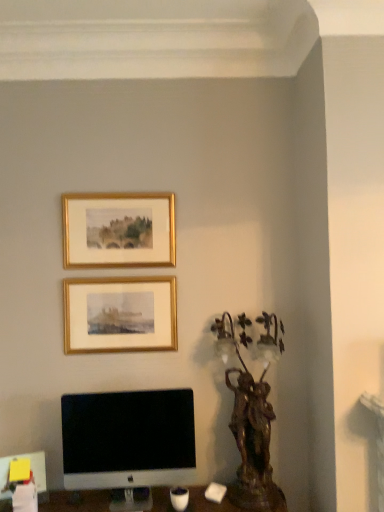
Question: In which direction should I rotate to look at gold/gilded picture frame at upper center, the 2th picture frame from the bottom?

Choices:
 (A) left
 (B) right

Answer: (A)

Question: Which direction should I rotate to look at gold/gilded picture frame at upper center, the 1th picture frame from the bottom?

Choices:
 (A) right
 (B) left

Answer: (B)

Question: Does white glossy computer monitor at lower left have a smaller size compared to gold/gilded picture frame at upper center, positioned as the 2th picture frame in top-to-bottom order?

Choices:
 (A) yes
 (B) no

Answer: (B)

Question: Considering the relative positions of white glossy computer monitor at lower left and gold/gilded picture frame at upper center, the 1th picture frame from the bottom, in the image provided, is white glossy computer monitor at lower left to the right of gold/gilded picture frame at upper center, the 1th picture frame from the bottom, from the viewer's perspective?

Choices:
 (A) yes
 (B) no

Answer: (A)

Question: Is white glossy computer monitor at lower left far away from gold/gilded picture frame at upper center, the 1th picture frame from the bottom?

Choices:
 (A) no
 (B) yes

Answer: (A)

Question: Considering the relative positions of white glossy computer monitor at lower left and gold/gilded picture frame at upper center, the 1th picture frame from the bottom, in the image provided, is white glossy computer monitor at lower left to the left of gold/gilded picture frame at upper center, the 1th picture frame from the bottom, from the viewer's perspective?

Choices:
 (A) yes
 (B) no

Answer: (B)

Question: Is white glossy computer monitor at lower left positioned behind gold/gilded picture frame at upper center, the 1th picture frame from the bottom?

Choices:
 (A) no
 (B) yes

Answer: (A)

Question: Considering the relative sizes of white glossy computer monitor at lower left and gold/gilded picture frame at upper center, the 1th picture frame from the bottom, in the image provided, is white glossy computer monitor at lower left bigger than gold/gilded picture frame at upper center, the 1th picture frame from the bottom,?

Choices:
 (A) yes
 (B) no

Answer: (A)

Question: From the image's perspective, would you say bronze statue at right is shown under gold/gilded picture frame at upper center, the 1th picture frame from the bottom?

Choices:
 (A) yes
 (B) no

Answer: (A)

Question: Can you confirm if bronze statue at right is bigger than gold/gilded picture frame at upper center, positioned as the 2th picture frame in top-to-bottom order?

Choices:
 (A) no
 (B) yes

Answer: (B)

Question: From a real-world perspective, does bronze statue at right sit lower than gold/gilded picture frame at upper center, the 1th picture frame from the bottom?

Choices:
 (A) yes
 (B) no

Answer: (A)

Question: From a real-world perspective, is bronze statue at right on top of gold/gilded picture frame at upper center, the 1th picture frame from the bottom?

Choices:
 (A) yes
 (B) no

Answer: (B)

Question: Can you confirm if bronze statue at right is smaller than gold/gilded picture frame at upper center, positioned as the 2th picture frame in top-to-bottom order?

Choices:
 (A) yes
 (B) no

Answer: (B)

Question: Can you confirm if bronze statue at right is positioned to the right of gold/gilded picture frame at upper center, the 1th picture frame from the bottom?

Choices:
 (A) no
 (B) yes

Answer: (B)

Question: Is bronze statue at right surrounding white glossy computer monitor at lower left?

Choices:
 (A) no
 (B) yes

Answer: (A)